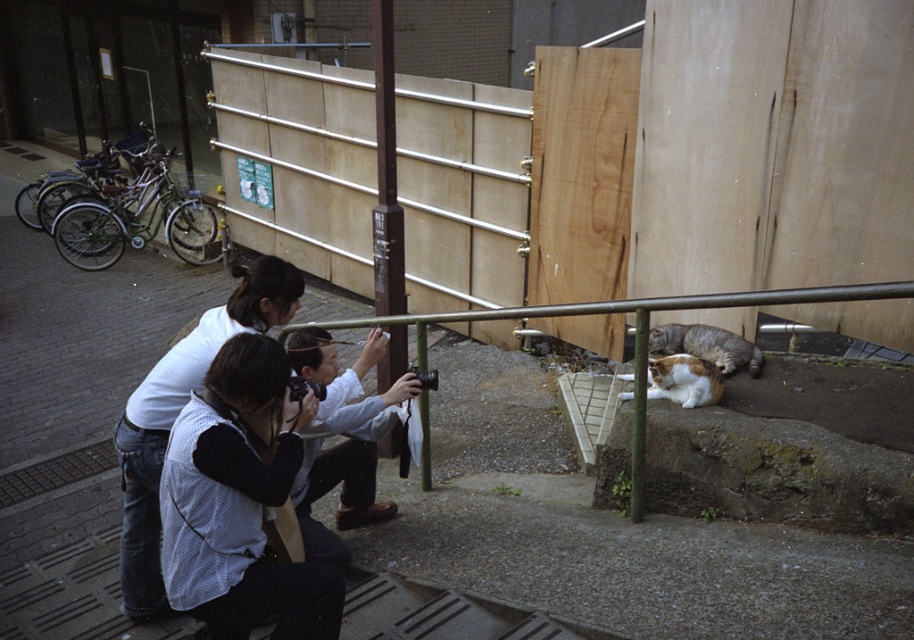
You are a photographer trying to capture both the white cotton shirt at center and the orange and white fur cat at lower right in the same frame. Which object takes up more space in the photo?

The white cotton shirt at center takes up more space in the photo because its width surpasses that of the orange and white fur cat at lower right.

You are a photographer trying to capture both the white shirt at lower left and the white cotton shirt at center in a single shot. Based on their positions, which shirt will appear closer to the camera in the photo?

The white shirt at lower left will appear closer to the camera because it is positioned over the white cotton shirt at center.

You are standing in the street scene and want to take a photo of both the white shirt at lower left and the gray tabby cat at lower right. Which one should you focus on first to ensure it appears sharp in your photo?

You should focus on the white shirt at lower left first because it is closer to the viewer than the gray tabby cat at lower right, so focusing on the closer subject will ensure it is sharp while the background subject may be slightly blurred.